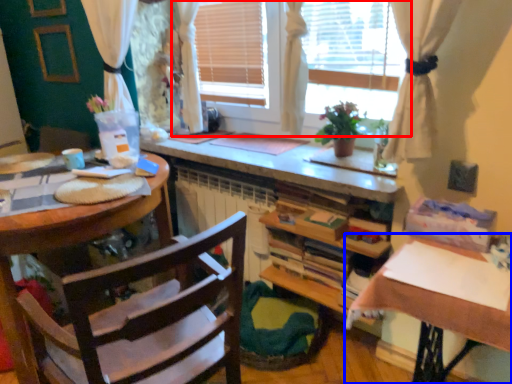
Question: Which point is further to the camera, window (highlighted by a red box) or table (highlighted by a blue box)?

Choices:
 (A) window
 (B) table

Answer: (A)